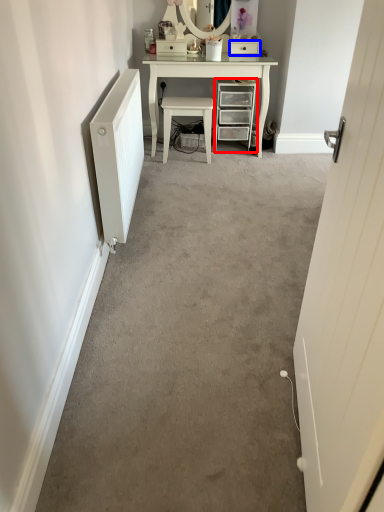
Question: Which object is closer to the camera taking this photo, chest of drawers (highlighted by a red box) or drawer (highlighted by a blue box)?

Choices:
 (A) chest of drawers
 (B) drawer

Answer: (A)